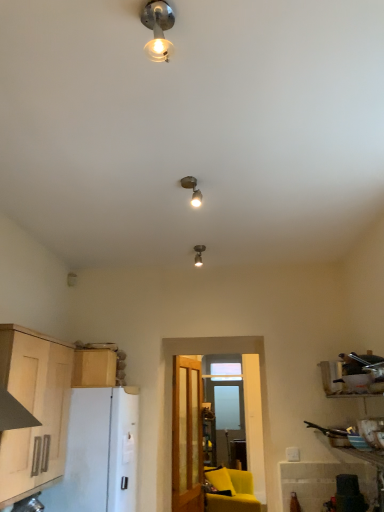
Question: Should I look upward or downward to see transparent glass window at center?

Choices:
 (A) up
 (B) down

Answer: (B)

Question: Is satin silver spotlight at center, the second lamp from the top, positioned beyond the bounds of light wood cabinet at left, which ranks as the first cabinetry in front-to-back order?

Choices:
 (A) yes
 (B) no

Answer: (A)

Question: From a real-world perspective, is satin silver spotlight at center, the second lamp when ordered from front to back, positioned over light wood cabinet at left, arranged as the 2th cabinetry when viewed from the back, based on gravity?

Choices:
 (A) no
 (B) yes

Answer: (B)

Question: Is satin silver spotlight at center, the second lamp from the top, facing away from light wood cabinet at left, which ranks as the first cabinetry in front-to-back order?

Choices:
 (A) yes
 (B) no

Answer: (B)

Question: Is satin silver spotlight at center, which is counted as the second lamp, starting from the back, far away from light wood cabinet at left, which ranks as the first cabinetry in front-to-back order?

Choices:
 (A) yes
 (B) no

Answer: (A)

Question: Is satin silver spotlight at center, which is counted as the second lamp, starting from the back, to the right of light wood cabinet at left, which ranks as the first cabinetry in front-to-back order, from the viewer's perspective?

Choices:
 (A) yes
 (B) no

Answer: (A)

Question: Is light wood cabinet at left, arranged as the 2th cabinetry when viewed from the back, completely or partially inside satin silver spotlight at center, which ranks as the 2th lamp in bottom-to-top order?

Choices:
 (A) no
 (B) yes

Answer: (A)

Question: Is matte silver spotlight at center, the 3th lamp when ordered from front to back, at the back of satin silver spotlight at center, which ranks as the 2th lamp in bottom-to-top order?

Choices:
 (A) no
 (B) yes

Answer: (B)

Question: Does satin silver spotlight at center, the second lamp when ordered from front to back, come in front of matte silver spotlight at center, which ranks as the 1th lamp in bottom-to-top order?

Choices:
 (A) yes
 (B) no

Answer: (A)

Question: Considering the relative sizes of satin silver spotlight at center, the second lamp when ordered from front to back, and matte silver spotlight at center, placed as the 3th lamp when sorted from top to bottom, in the image provided, is satin silver spotlight at center, the second lamp when ordered from front to back, wider than matte silver spotlight at center, placed as the 3th lamp when sorted from top to bottom,?

Choices:
 (A) yes
 (B) no

Answer: (B)

Question: Is there a large distance between satin silver spotlight at center, the second lamp from the top, and matte silver spotlight at center, placed as the 3th lamp when sorted from top to bottom?

Choices:
 (A) no
 (B) yes

Answer: (A)

Question: Does satin silver spotlight at center, the second lamp when ordered from front to back, turn towards matte silver spotlight at center, the 3th lamp when ordered from front to back?

Choices:
 (A) yes
 (B) no

Answer: (B)

Question: From the image's perspective, is satin silver spotlight at center, which is counted as the second lamp, starting from the back, above matte silver spotlight at center, placed as the 1th lamp when sorted from back to front?

Choices:
 (A) yes
 (B) no

Answer: (A)

Question: Considering the relative sizes of clear glass door at center and matte yellow armchair at lower center in the image provided, is clear glass door at center shorter than matte yellow armchair at lower center?

Choices:
 (A) no
 (B) yes

Answer: (A)